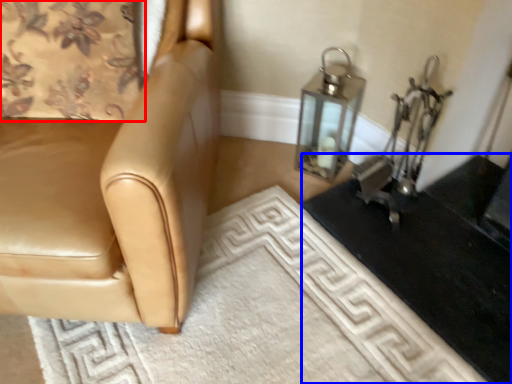
Question: Which object is closer to the camera taking this photo, curtain (highlighted by a red box) or table (highlighted by a blue box)?

Choices:
 (A) curtain
 (B) table

Answer: (B)